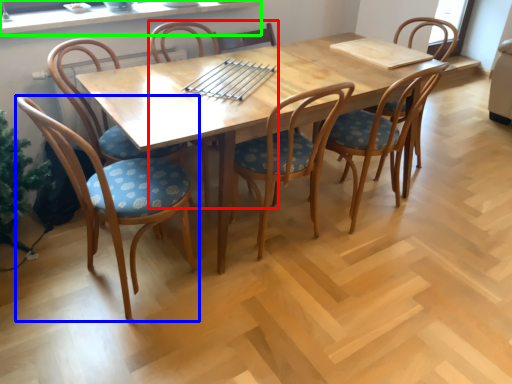
Question: Which object is the closest to the chair (highlighted by a red box)? Choose among these: chair (highlighted by a blue box) or window sill (highlighted by a green box).

Choices:
 (A) chair
 (B) window sill

Answer: (B)